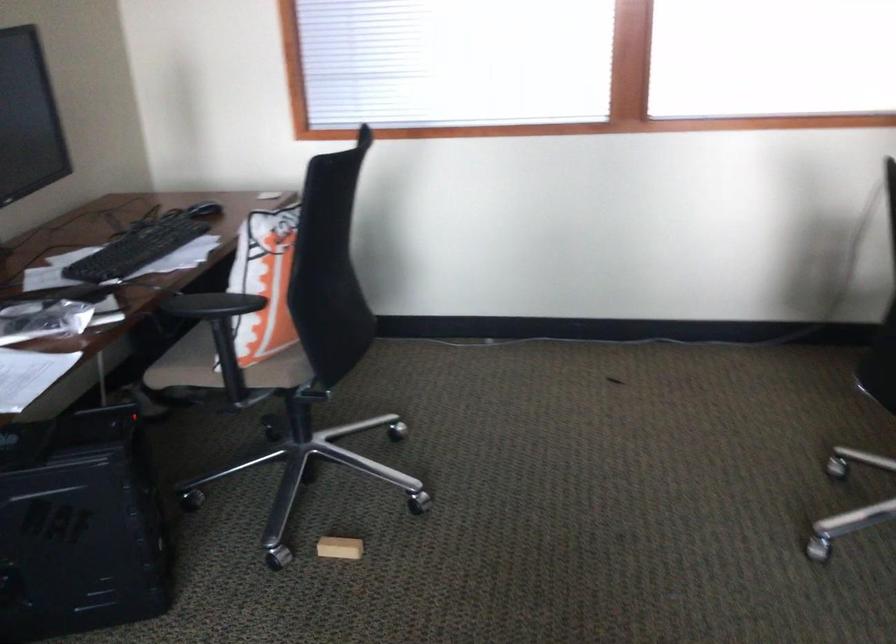
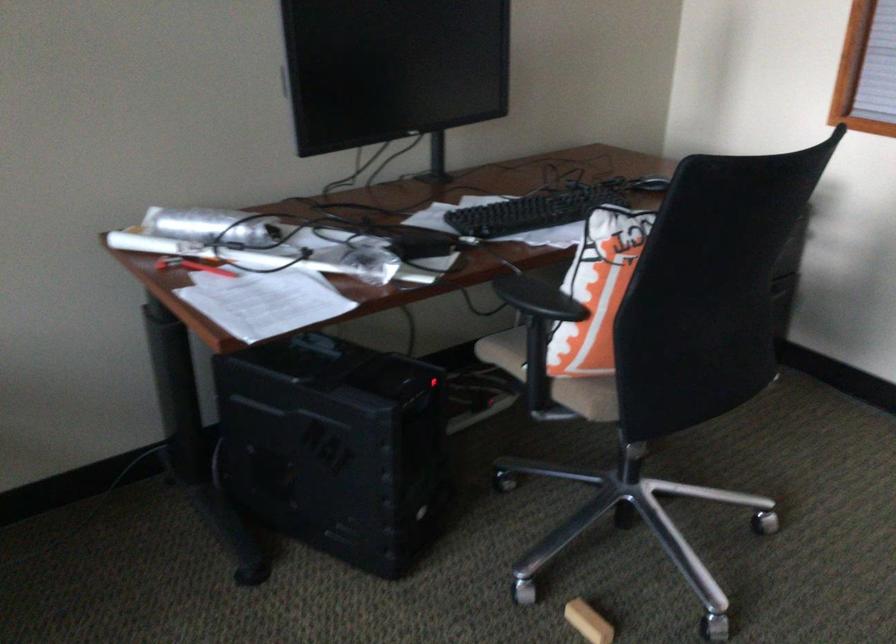
In the second image, find the point that corresponds to [147,247] in the first image.

(532, 211)